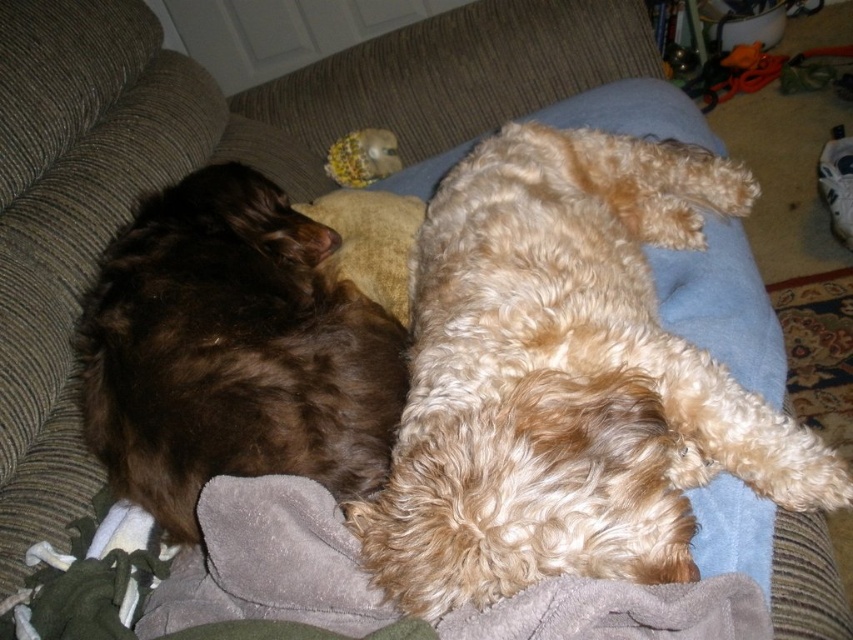
You are standing in front of the couch and want to place a small toy exactly at the point marked by coordinates point (566, 380). Which animal will the toy land on?

The point (566, 380) is on the curly golden fur dog at center, so the toy will land on the dog.

You are a pet sitter who needs to separate the curly golden fur dog at center and the brown fluffy dog at left. Which dog should you approach first if you want to reach the one that is closer to you?

The curly golden fur dog at center is in front of the brown fluffy dog at left, so you should approach the curly golden fur dog at center first since it is closer to you.